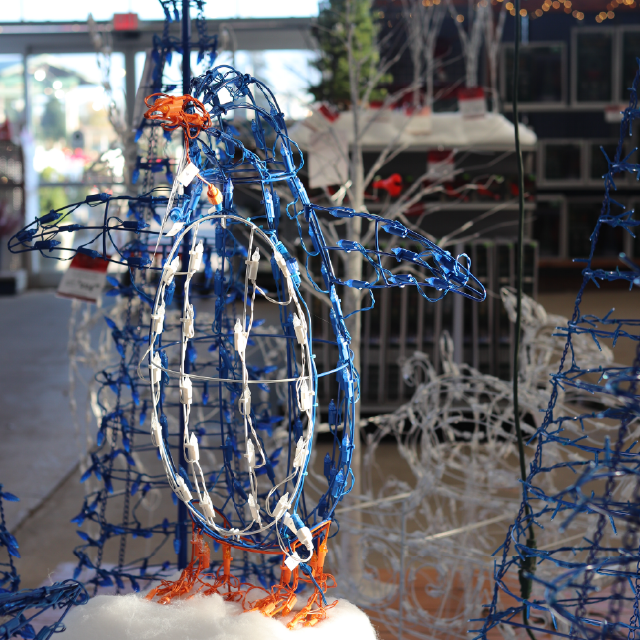
This screenshot has height=640, width=640. Identify the location of door. (74, 134).